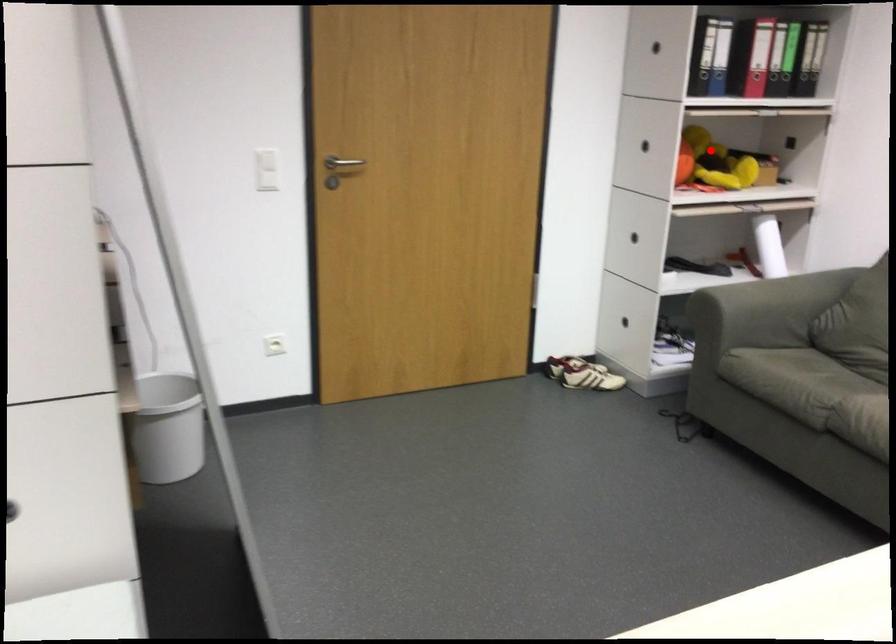
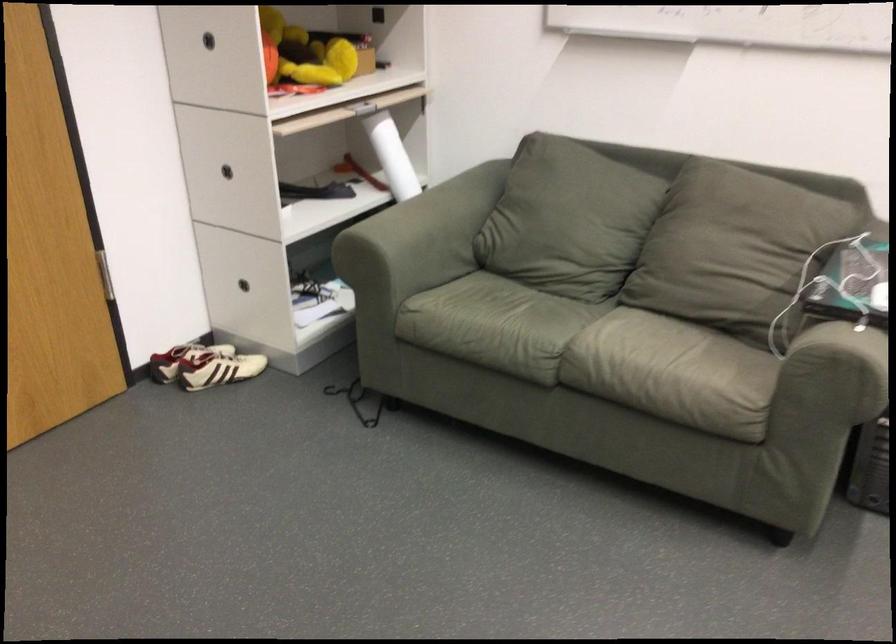
Locate, in the second image, the point that corresponds to the highlighted location in the first image.

(303, 53)